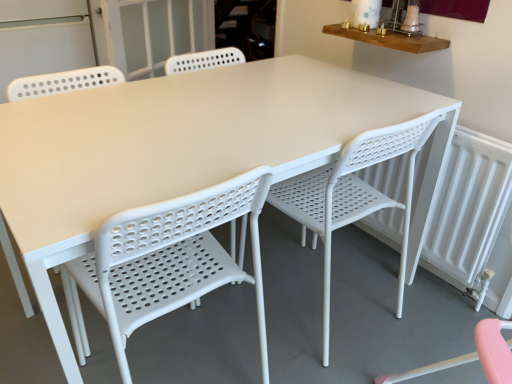
The height and width of the screenshot is (384, 512). Find the location of `vacant space in between white perforated plastic chair at center, arranged as the 2th chair when viewed from the right, and white plastic chair at center, placed as the 1th chair when sorted from right to left`. vacant space in between white perforated plastic chair at center, arranged as the 2th chair when viewed from the right, and white plastic chair at center, placed as the 1th chair when sorted from right to left is located at coordinates (253, 334).